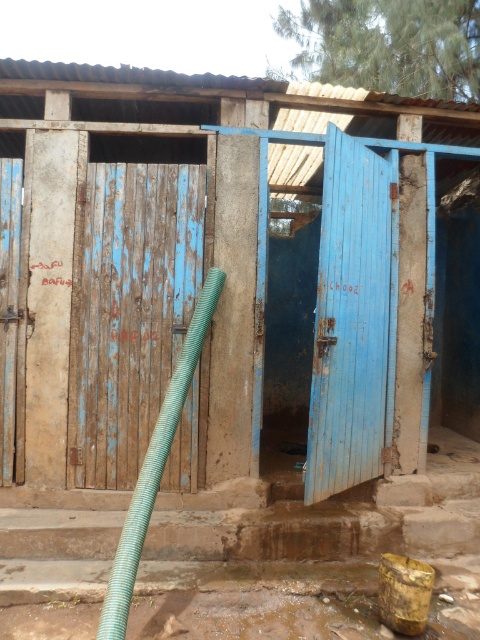
You are standing in front of the blue painted wood door at center. What are the coordinates of the door?

The coordinates of the blue painted wood door at center are point (352, 317).

You are standing in front of the restroom and want to place a small potted plant between the two points marked as point (107, 240) and point (13, 268). Which point should the plant be closer to so it is nearer to the viewer?

The plant should be closer to point (107, 240) because it is further to the viewer than point (13, 268).